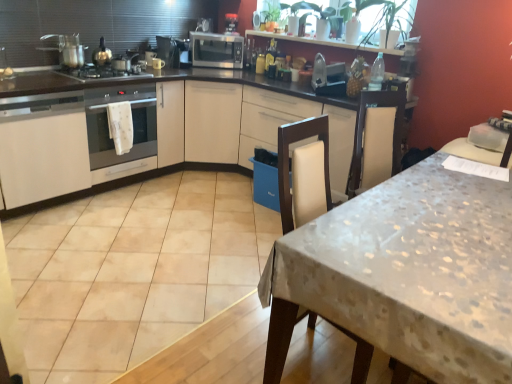
At what (x,y) coordinates should I click in order to perform the action: click on blank space above satin silver microwave at center (from a real-world perspective). Please return your answer as a coordinate pair (x, y). The width and height of the screenshot is (512, 384). Looking at the image, I should click on (111, 75).